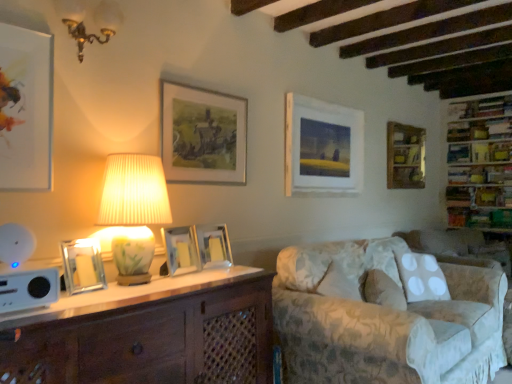
What do you see at coordinates (25, 109) in the screenshot? I see `matte white picture frame at upper left, arranged as the first picture frame when viewed from the left` at bounding box center [25, 109].

You are a GUI agent. You are given a task and a screenshot of the screen. Output one action in this format:
    pyautogui.click(x=<x>, y=<y>)
    Task: Click on the matte white picture frame at upper left, which is the 1th picture frame from front to back
    The height and width of the screenshot is (384, 512).
    Given the screenshot: What is the action you would take?
    pyautogui.click(x=25, y=109)

What do you see at coordinates (480, 163) in the screenshot? I see `wooden bookshelf at right, the 2th shelf when ordered from top to bottom` at bounding box center [480, 163].

Find the location of a particular element. wooden picture frame at upper right, which is the 1th picture frame in right-to-left order is located at coordinates (405, 156).

I want to click on pillow that is below the gold-framed painting at upper center, which is the 3th picture frame in back-to-front order (from the image's perspective), so click(383, 290).

From a real-world perspective, is gold-framed painting at upper center, which is counted as the fifth picture frame, starting from the front, on fluffy white pillow at lower right?

Yes.

Considering the positions of objects gold-framed painting at upper center, which ranks as the 4th picture frame in right-to-left order, and fluffy white pillow at lower right in the image provided, who is more to the left, gold-framed painting at upper center, which ranks as the 4th picture frame in right-to-left order, or fluffy white pillow at lower right?

From the viewer's perspective, gold-framed painting at upper center, which ranks as the 4th picture frame in right-to-left order, appears more on the left side.

Is fluffy white pillow at lower right inside gold-framed painting at upper center, which ranks as the 4th picture frame in right-to-left order?

Definitely not — fluffy white pillow at lower right is not inside gold-framed painting at upper center, which ranks as the 4th picture frame in right-to-left order.

Considering the sizes of objects wooden picture frame at upper right, acting as the first picture frame starting from the back, and white wood cabinet at lower left in the image provided, who is smaller, wooden picture frame at upper right, acting as the first picture frame starting from the back, or white wood cabinet at lower left?

With smaller size is wooden picture frame at upper right, acting as the first picture frame starting from the back.

From the picture: Is wooden picture frame at upper right, which is the 1th picture frame in right-to-left order, positioned with its back to white wood cabinet at lower left?

No, wooden picture frame at upper right, which is the 1th picture frame in right-to-left order, is not facing away from white wood cabinet at lower left.

In terms of width, does wooden picture frame at upper right, placed as the 7th picture frame when sorted from front to back, look wider or thinner when compared to white wood cabinet at lower left?

Clearly, wooden picture frame at upper right, placed as the 7th picture frame when sorted from front to back, has less width compared to white wood cabinet at lower left.

In terms of height, does wooden bookshelf at upper right, the first shelf when ordered from top to bottom, look taller or shorter compared to gold-framed painting at upper center, which ranks as the 4th picture frame in right-to-left order?

Clearly, wooden bookshelf at upper right, the first shelf when ordered from top to bottom, is shorter compared to gold-framed painting at upper center, which ranks as the 4th picture frame in right-to-left order.

Is wooden bookshelf at upper right, which is the 2th shelf from bottom to top, oriented towards gold-framed painting at upper center, acting as the 4th picture frame starting from the left?

Yes, wooden bookshelf at upper right, which is the 2th shelf from bottom to top, is oriented towards gold-framed painting at upper center, acting as the 4th picture frame starting from the left.

Considering the relative positions of wooden bookshelf at upper right, the first shelf when ordered from top to bottom, and gold-framed painting at upper center, which ranks as the 4th picture frame in right-to-left order, in the image provided, is wooden bookshelf at upper right, the first shelf when ordered from top to bottom, in front of gold-framed painting at upper center, which ranks as the 4th picture frame in right-to-left order,?

No, wooden bookshelf at upper right, the first shelf when ordered from top to bottom, is behind gold-framed painting at upper center, which ranks as the 4th picture frame in right-to-left order.

Which is more distant, (454, 150) or (185, 136)?

Point (454, 150)

Which is nearer, (10, 94) or (505, 153)?

Point (10, 94).

Considering the relative sizes of matte white picture frame at upper left, arranged as the first picture frame when viewed from the left, and wooden bookshelf at right, placed as the 1th shelf when sorted from bottom to top, in the image provided, is matte white picture frame at upper left, arranged as the first picture frame when viewed from the left, bigger than wooden bookshelf at right, placed as the 1th shelf when sorted from bottom to top,?

No, matte white picture frame at upper left, arranged as the first picture frame when viewed from the left, is not bigger than wooden bookshelf at right, placed as the 1th shelf when sorted from bottom to top.

Do you think matte white picture frame at upper left, which is the 7th picture frame in right-to-left order, is within wooden bookshelf at right, placed as the 1th shelf when sorted from bottom to top, or outside of it?

The correct answer is: outside.

Is white wood cabinet at lower left bigger than wooden bookshelf at upper right, the first shelf when ordered from top to bottom?

Yes, white wood cabinet at lower left is bigger than wooden bookshelf at upper right, the first shelf when ordered from top to bottom.

From their relative heights in the image, would you say white wood cabinet at lower left is taller or shorter than wooden bookshelf at upper right, which is the 2th shelf from bottom to top?

white wood cabinet at lower left is taller than wooden bookshelf at upper right, which is the 2th shelf from bottom to top.

How different are the orientations of white wood cabinet at lower left and wooden bookshelf at upper right, which is the 2th shelf from bottom to top, in degrees?

They differ by 87.7 degrees in their facing directions.

From the picture: Is floral fabric couch at lower right outside of gold metallic chandelier at upper left, placed as the second lamp when sorted from bottom to top?

Yes, floral fabric couch at lower right is located beyond the bounds of gold metallic chandelier at upper left, placed as the second lamp when sorted from bottom to top.

Is point (449, 359) closer or farther from the camera than point (78, 3)?

Clearly, point (449, 359) is more distant from the camera than point (78, 3).

Based on their sizes in the image, would you say floral fabric couch at lower right is bigger or smaller than gold metallic chandelier at upper left, which is the first lamp from top to bottom?

Considering their sizes, floral fabric couch at lower right takes up more space than gold metallic chandelier at upper left, which is the first lamp from top to bottom.

How many degrees apart are the facing directions of floral fabric couch at lower right and wooden bookshelf at upper right, the first shelf when ordered from top to bottom?

They differ by 90.4 degrees in their facing directions.

Would you say floral fabric couch at lower right is to the left or to the right of wooden bookshelf at upper right, which is the 2th shelf from bottom to top, in the picture?

From the image, it's evident that floral fabric couch at lower right is to the left of wooden bookshelf at upper right, which is the 2th shelf from bottom to top.

From a real-world perspective, is floral fabric couch at lower right positioned under wooden bookshelf at upper right, the first shelf when ordered from top to bottom, based on gravity?

Yes, from a real-world perspective, floral fabric couch at lower right is below wooden bookshelf at upper right, the first shelf when ordered from top to bottom.

Measure the distance from floral fabric couch at lower right to wooden bookshelf at upper right, the first shelf when ordered from top to bottom.

floral fabric couch at lower right is 2.64 meters from wooden bookshelf at upper right, the first shelf when ordered from top to bottom.

Find the location of a particular element. pillow located below the gold-framed painting at upper center, which is the 3th picture frame in back-to-front order (from the image's perspective) is located at coordinates (383, 290).

This screenshot has height=384, width=512. I want to click on cabinetry that is in front of the wooden picture frame at upper right, which is the 1th picture frame in right-to-left order, so click(150, 338).

Considering their positions, is fluffy white pillow at lower right positioned further to matte glass picture frame at center, which is the fifth picture frame from right to left, than wooden picture frame at upper right, the 7th picture frame viewed from the left?

wooden picture frame at upper right, the 7th picture frame viewed from the left, lies further to matte glass picture frame at center, which is the fifth picture frame from right to left, than the other object.

Which object lies further to the anchor point wooden bookshelf at right, the 2th shelf when ordered from top to bottom, white pleated fabric lampshade at upper left, which is counted as the first lamp, starting from the bottom, or silver metallic picture frame at center, acting as the fourth picture frame starting from the back?

Based on the image, white pleated fabric lampshade at upper left, which is counted as the first lamp, starting from the bottom, appears to be further to wooden bookshelf at right, the 2th shelf when ordered from top to bottom.

Based on their spatial positions, is white wood cabinet at lower left or wooden bookshelf at right, placed as the 1th shelf when sorted from bottom to top, closer to matte white picture frame at upper left, which is the 7th picture frame in right-to-left order?

white wood cabinet at lower left is positioned closer to the anchor matte white picture frame at upper left, which is the 7th picture frame in right-to-left order.

Based on the photo, based on their spatial positions, is white pleated fabric lampshade at upper left, which is counted as the first lamp, starting from the bottom, or wooden bookshelf at upper right, which is the 2th shelf from bottom to top, closer to floral fabric couch at lower right?

white pleated fabric lampshade at upper left, which is counted as the first lamp, starting from the bottom, lies closer to floral fabric couch at lower right than the other object.

From the picture: Considering their positions, is gold metallic chandelier at upper left, which is the first lamp from top to bottom, positioned further to gold-framed painting at upper center, which ranks as the 4th picture frame in right-to-left order, than wooden bookshelf at right, the 2th shelf when ordered from top to bottom?

wooden bookshelf at right, the 2th shelf when ordered from top to bottom, is further to gold-framed painting at upper center, which ranks as the 4th picture frame in right-to-left order.

From the image, which object appears to be farther from silver metallic picture frame at center, which is the 5th picture frame from left to right, gold-framed painting at upper center, acting as the 4th picture frame starting from the left, or wooden bookshelf at right, placed as the 1th shelf when sorted from bottom to top?

wooden bookshelf at right, placed as the 1th shelf when sorted from bottom to top, is positioned further to the anchor silver metallic picture frame at center, which is the 5th picture frame from left to right.

In the scene shown: Looking at the image, which one is located further to white plastic speaker at lower left, matte white picture frame at upper left, arranged as the first picture frame when viewed from the left, or gold metallic chandelier at upper left, placed as the second lamp when sorted from bottom to top?

gold metallic chandelier at upper left, placed as the second lamp when sorted from bottom to top.

Based on their spatial positions, is matte white picture frame at upper left, which is counted as the seventh picture frame, starting from the back, or white pleated fabric lampshade at upper left, which appears as the 2th lamp when viewed from the top, further from fluffy white pillow at lower right?

matte white picture frame at upper left, which is counted as the seventh picture frame, starting from the back.

Locate an element on the screen. The height and width of the screenshot is (384, 512). pillow situated between white pleated fabric lampshade at upper left, which appears as the 2th lamp when viewed from the top, and floral fabric couch at lower right from left to right is located at coordinates (383, 290).

This screenshot has width=512, height=384. I want to click on studio couch positioned between white wood cabinet at lower left and wooden bookshelf at upper right, the first shelf when ordered from top to bottom, from near to far, so click(x=385, y=317).

Locate an element on the screen. This screenshot has width=512, height=384. pillow between gold metallic chandelier at upper left, which is the first lamp from top to bottom, and wooden bookshelf at upper right, the first shelf when ordered from top to bottom, from left to right is located at coordinates pyautogui.click(x=383, y=290).

I want to click on pillow between white wood cabinet at lower left and wooden bookshelf at upper right, which is the 2th shelf from bottom to top, along the z-axis, so click(x=383, y=290).